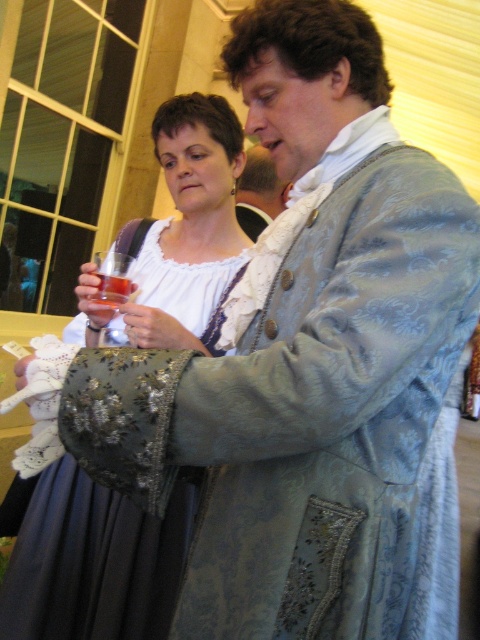
You are a costume designer preparing for a historical play. You need to ensure that the matte white lace dress at center can be worn over the translucent glass at upper left. Based on the scene description, is this possible?

The matte white lace dress at center might be wider than translucent glass at upper left, so it is possible that the dress can be worn over the glass without issues.

You are a guest at a historical event and see the silvery brocade coat at upper center and the transparent glass at upper left. Which object is positioned higher in the image?

The silvery brocade coat at upper center is positioned higher than the transparent glass at upper left.

You are a photographer at a historical event. You want to capture a photo of the matte white lace dress at center and the translucent glass at upper left. Which object should be placed closer to the camera to ensure both are in focus?

The translucent glass at upper left is behind the matte white lace dress at center, so to ensure both are in focus, the matte white lace dress at center should be closer to the camera.